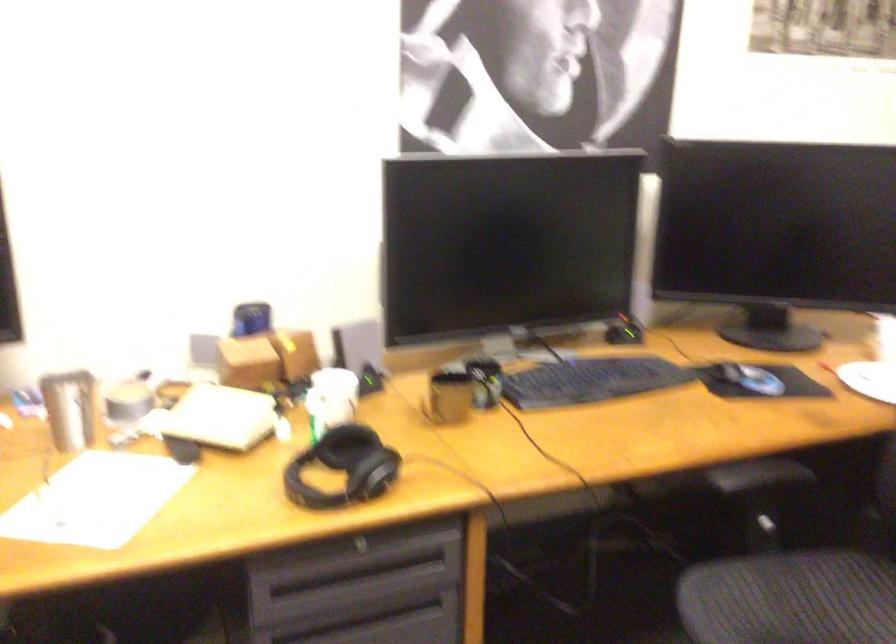
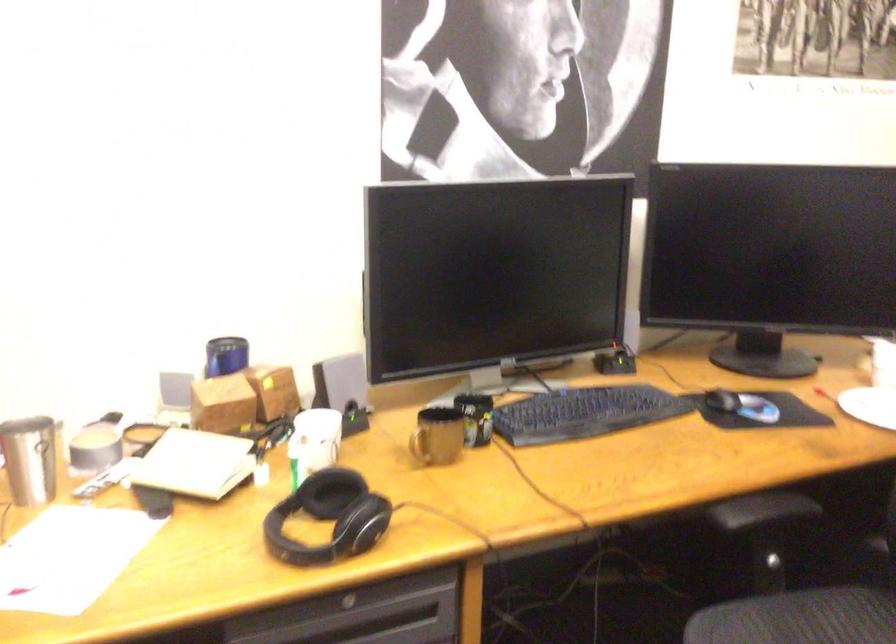
Find the pixel in the second image that matches [754,491] in the first image.

(762, 529)